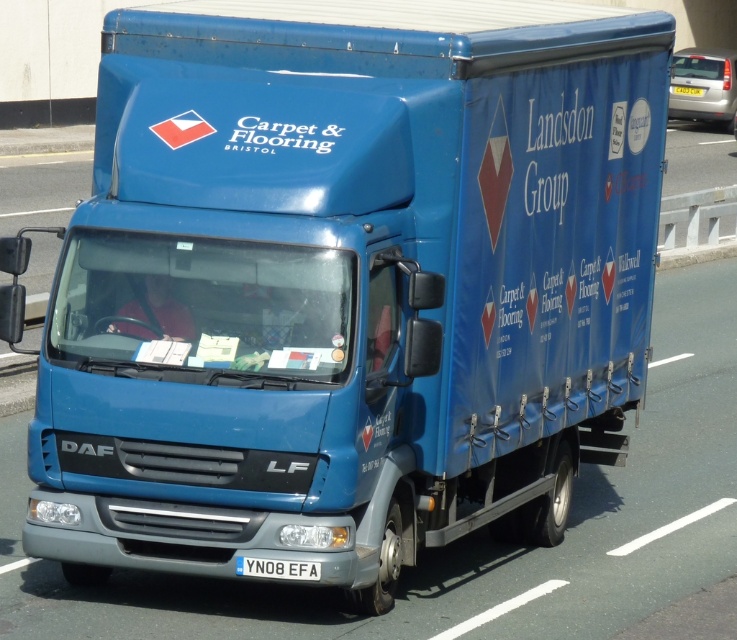
You are a traffic camera positioned on a pole. You need to capture the license plate of the blue DAF LF truck driving on the road. The minimum distance required for clear license plate capture is 7 meters. Is the white plastic license plate at bottom within the camera range?

The distance of white plastic license plate at bottom from viewer is 7.36 meters, which is within the minimum required distance of 7 meters for clear capture. Therefore, the license plate can be captured clearly.

You are a pedestrian standing at point (x=691, y=92) and want to cross the road to reach point (x=240, y=561). Given that the blue DAF LF truck is moving towards your direction, is it safe to cross directly in front of the truck?

Point (x=240, y=561) is in front of point (x=691, y=92), so if the blue DAF LF truck is moving towards your current position at point (x=691, y=92), crossing directly in front of the truck would place you in its path. It is not safe to cross there.